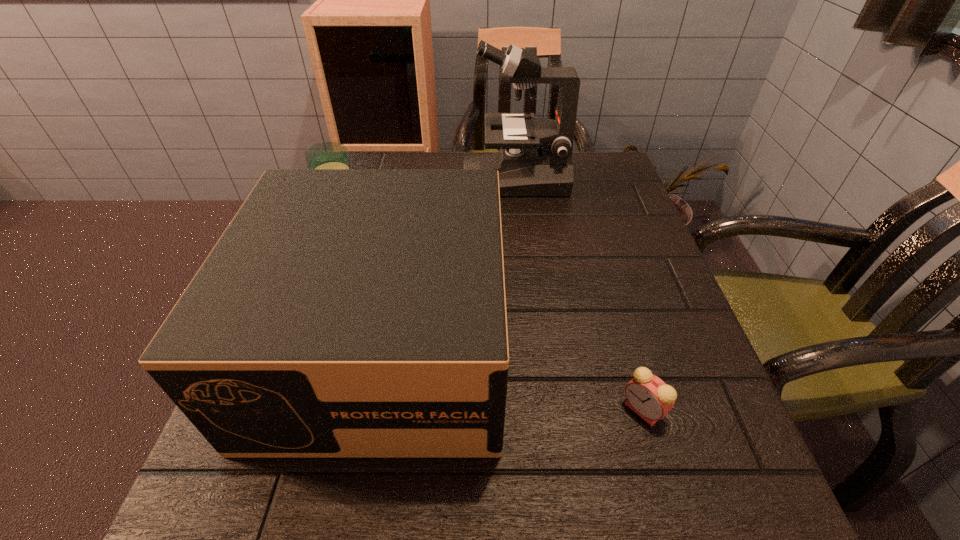
The height and width of the screenshot is (540, 960). I want to click on free location that satisfies the following two spatial constraints: 1. through the eyepieces of the tallest object; 2. on the front-facing side of the box, so click(x=532, y=345).

Locate an element on the screen. The width and height of the screenshot is (960, 540). free space in the image that satisfies the following two spatial constraints: 1. through the eyepieces of the tallest object; 2. on the front-facing side of the third shortest object is located at coordinates (532, 345).